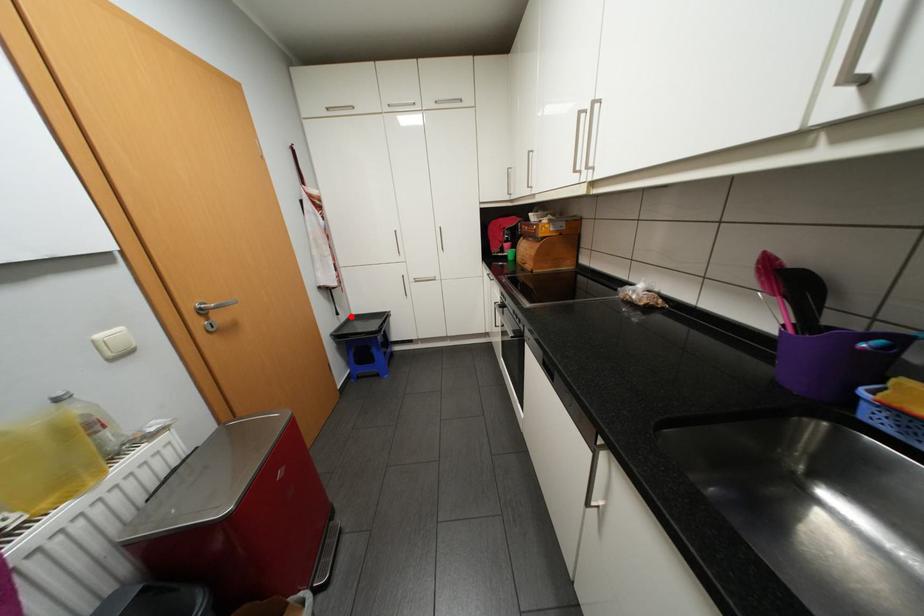
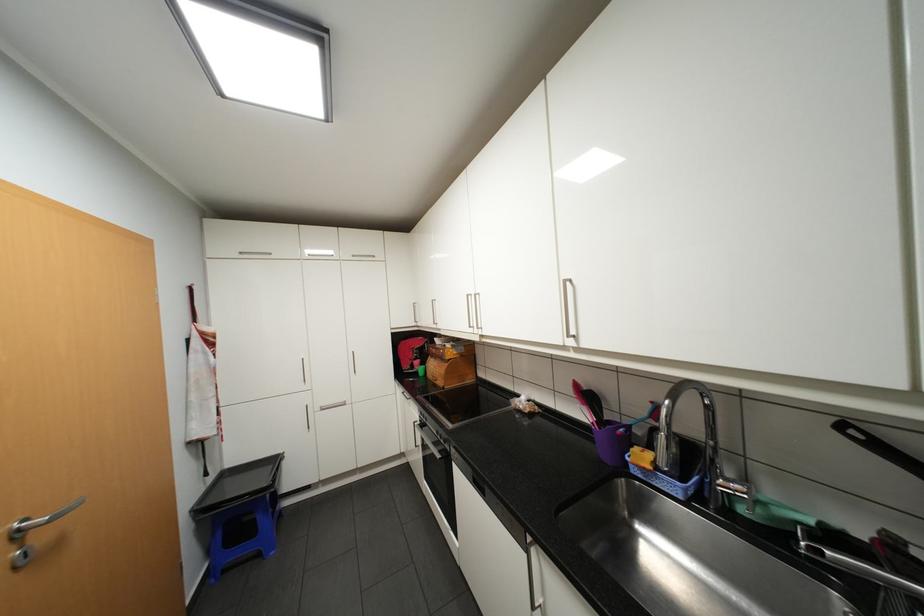
Locate, in the second image, the point that corresponds to the highlighted location in the first image.

(220, 476)